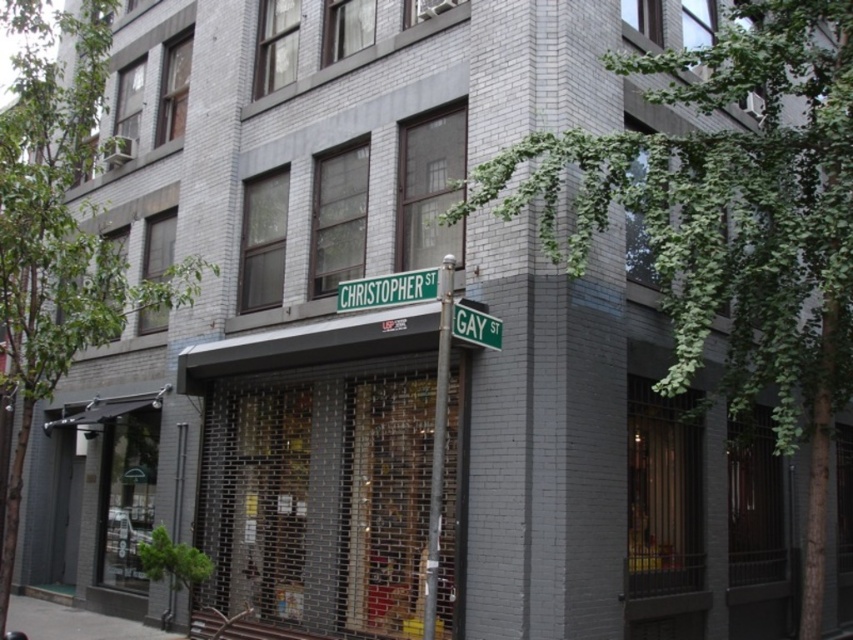
Is metallic pole at center smaller than green metallic street sign at center?

No.

Is point (440, 344) in front of point (415, 291)?

Yes.

Image resolution: width=853 pixels, height=640 pixels. In order to click on metallic pole at center in this screenshot , I will do `click(438, 442)`.

Can you confirm if green leafy tree at upper right is positioned to the right of green metallic street sign at center?

Yes, green leafy tree at upper right is to the right of green metallic street sign at center.

Is green leafy tree at upper right behind green metallic street sign at center?

No, it is in front of green metallic street sign at center.

Who is more distant from viewer, (799, 428) or (341, 288)?

The point (799, 428) is more distant.

Where is `green leafy tree at upper right`? green leafy tree at upper right is located at coordinates (730, 221).

Between gray concrete pavement at lower left and green metallic street sign at center, which one has more height?

gray concrete pavement at lower left is taller.

Looking at this image, who is more forward, (59, 628) or (416, 273)?

Point (416, 273) is more forward.

Locate an element on the screen. This screenshot has height=640, width=853. gray concrete pavement at lower left is located at coordinates tap(74, 621).